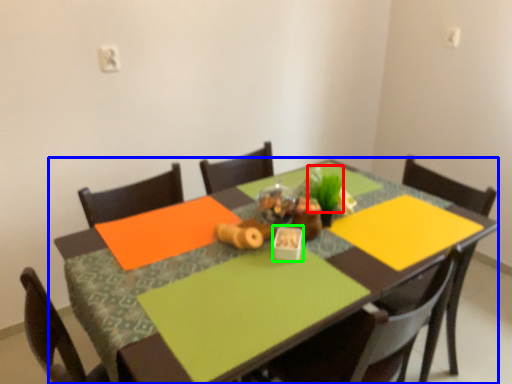
Question: Considering the real-world distances, which object is farthest from plant (highlighted by a red box)? table (highlighted by a blue box) or tableware (highlighted by a green box)?

Choices:
 (A) table
 (B) tableware

Answer: (A)